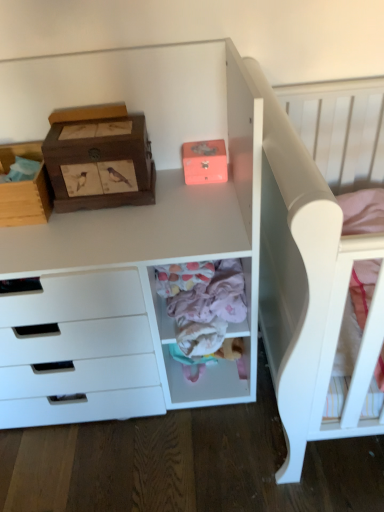
Question: Which direction should I rotate to look at matte pink shoe box at upper center, the first shoe box when ordered from right to left, — up or down?

Choices:
 (A) up
 (B) down

Answer: (A)

Question: Is white matte bed at upper right wider than matte pink shoe box at upper center, which is the second shoe box in left-to-right order?

Choices:
 (A) yes
 (B) no

Answer: (A)

Question: From the image's perspective, is white matte bed at upper right located beneath matte pink shoe box at upper center, the first shoe box when ordered from right to left?

Choices:
 (A) no
 (B) yes

Answer: (B)

Question: Considering the relative sizes of white matte bed at upper right and matte pink shoe box at upper center, the first shoe box when ordered from right to left, in the image provided, is white matte bed at upper right taller than matte pink shoe box at upper center, the first shoe box when ordered from right to left,?

Choices:
 (A) yes
 (B) no

Answer: (A)

Question: Is white matte bed at upper right bigger than matte pink shoe box at upper center, which is the second shoe box in left-to-right order?

Choices:
 (A) yes
 (B) no

Answer: (A)

Question: Is white matte bed at upper right shorter than matte pink shoe box at upper center, which is the second shoe box in left-to-right order?

Choices:
 (A) no
 (B) yes

Answer: (A)

Question: From a real-world perspective, is white matte bed at upper right over matte pink shoe box at upper center, which is the second shoe box in left-to-right order?

Choices:
 (A) yes
 (B) no

Answer: (B)

Question: Is woodenmaterial/textureshoe box at upper left, the first shoe box viewed from the left, surrounding wooden cardboard box at left?

Choices:
 (A) yes
 (B) no

Answer: (B)

Question: Can you confirm if woodenmaterial/textureshoe box at upper left, which appears as the 2th shoe box when viewed from the right, is wider than wooden cardboard box at left?

Choices:
 (A) no
 (B) yes

Answer: (A)

Question: Is woodenmaterial/textureshoe box at upper left, the first shoe box viewed from the left, at the left side of wooden cardboard box at left?

Choices:
 (A) no
 (B) yes

Answer: (A)

Question: Is the position of woodenmaterial/textureshoe box at upper left, the first shoe box viewed from the left, more distant than that of wooden cardboard box at left?

Choices:
 (A) no
 (B) yes

Answer: (A)

Question: Is woodenmaterial/textureshoe box at upper left, the first shoe box viewed from the left, facing towards wooden cardboard box at left?

Choices:
 (A) yes
 (B) no

Answer: (B)

Question: Can you confirm if woodenmaterial/textureshoe box at upper left, the first shoe box viewed from the left, is positioned to the right of wooden cardboard box at left?

Choices:
 (A) no
 (B) yes

Answer: (B)

Question: Is wooden cardboard box at left further to the viewer compared to pastel pink fabric at center?

Choices:
 (A) yes
 (B) no

Answer: (A)